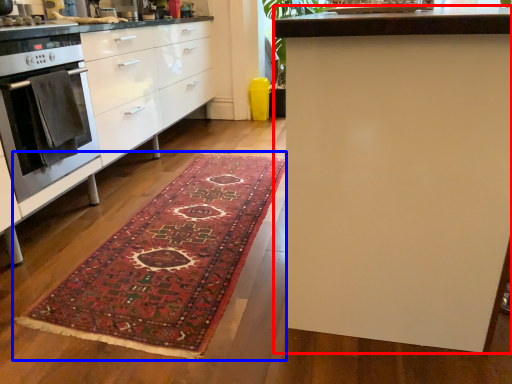
Question: Which of the following is the closest to the observer, table (highlighted by a red box) or mat (highlighted by a blue box)?

Choices:
 (A) table
 (B) mat

Answer: (A)